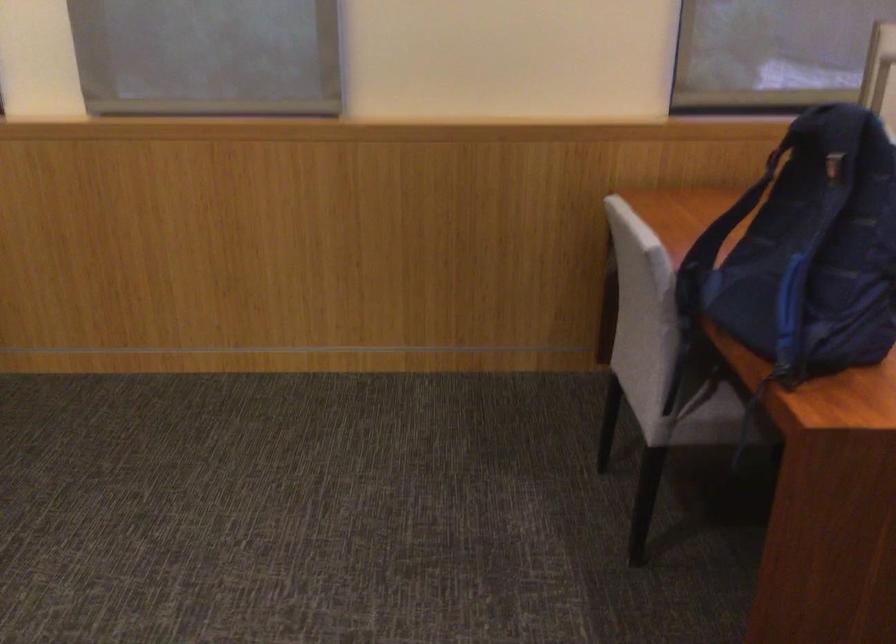
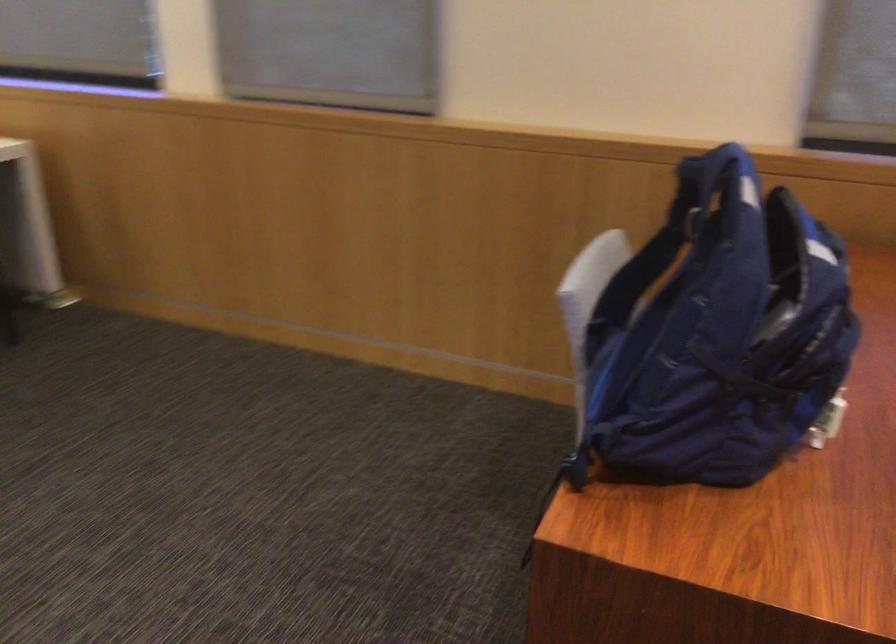
Question: The images are taken continuously from a first-person perspective. In which direction is your viewpoint rotating?

Choices:
 (A) Left
 (B) Right
 (C) Up
 (D) Down

Answer: (A)